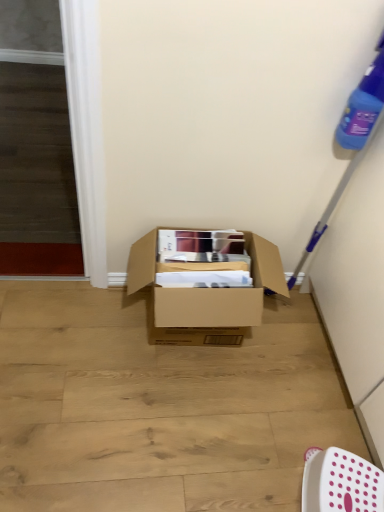
Locate an element on the screen. Image resolution: width=384 pixels, height=512 pixels. free space that is to the left of white plastic chair at lower right is located at coordinates (274, 463).